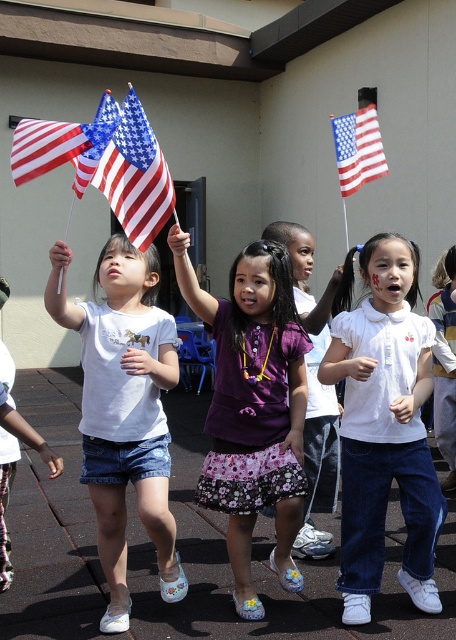
In the scene, there are a purple satin dress at center and a matte fabric flag at upper left. From the perspective of an observer looking at the image, which object is positioned to the left of the other?

The matte fabric flag at upper left is to the left of the purple satin dress at center.

You are a photographer trying to capture a clear shot of the purple floral skirt at center and the matte fabric flag at upper left. Which object should you focus on first if you want to ensure both are in focus?

The purple floral skirt at center is positioned under matte fabric flag at upper left. To ensure both are in focus, you should focus on the matte fabric flag at upper left first since it is farther away, allowing the depth of field to cover both objects.